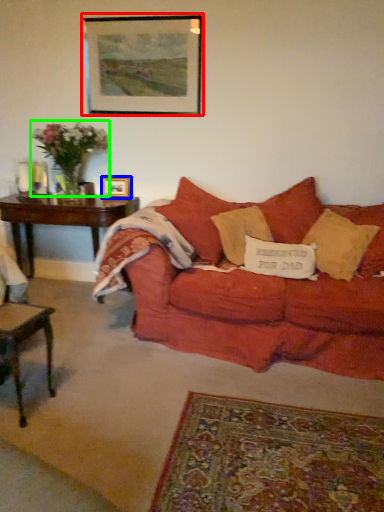
Question: Considering the real-world distances, which object is closest to picture frame (highlighted by a red box)? picture frame (highlighted by a blue box) or flower (highlighted by a green box).

Choices:
 (A) picture frame
 (B) flower

Answer: (B)